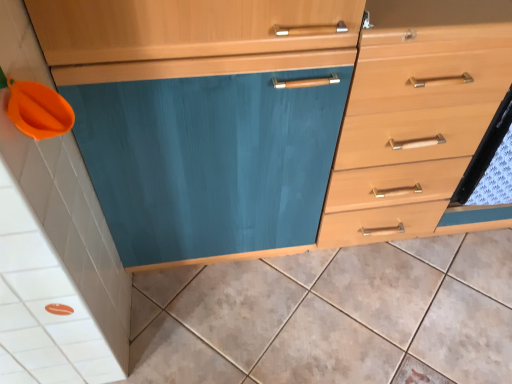
Question: Is light wood drawer at center right in front of or behind matte ceramic tile at lower left in the image?

Choices:
 (A) front
 (B) behind

Answer: (A)

Question: From a real-world perspective, is light wood drawer at center right above or below matte ceramic tile at lower left?

Choices:
 (A) above
 (B) below

Answer: (A)

Question: In terms of size, does light wood drawer at center right appear bigger or smaller than matte ceramic tile at lower left?

Choices:
 (A) small
 (B) big

Answer: (B)

Question: In terms of size, does matte ceramic tile at lower left appear bigger or smaller than light wood drawer at center right?

Choices:
 (A) small
 (B) big

Answer: (A)

Question: Is matte ceramic tile at lower left in front of or behind light wood drawer at center right in the image?

Choices:
 (A) front
 (B) behind

Answer: (B)

Question: Does point (423, 352) appear closer or farther from the camera than point (431, 137)?

Choices:
 (A) closer
 (B) farther

Answer: (B)

Question: Is matte ceramic tile at lower left taller or shorter than light wood drawer at center right?

Choices:
 (A) tall
 (B) short

Answer: (B)